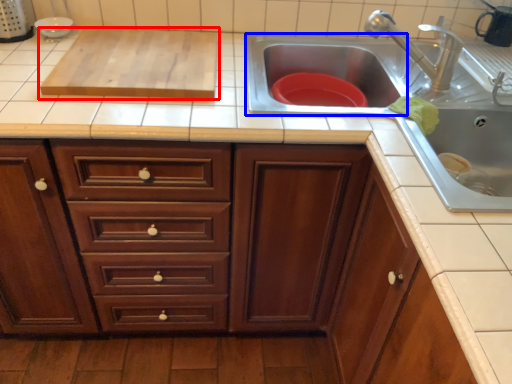
Question: Which of the following is the closest to the observer, wide (highlighted by a red box) or sink (highlighted by a blue box)?

Choices:
 (A) wide
 (B) sink

Answer: (A)